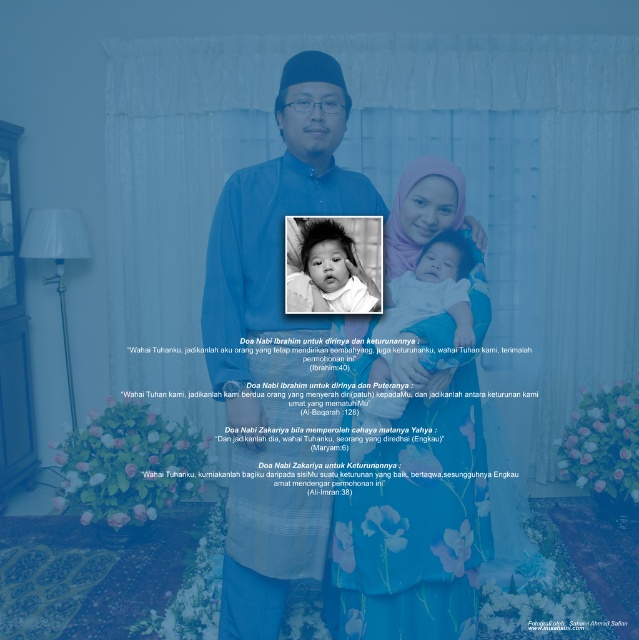
Measure the distance between point (450, 289) and camera.

The distance of point (450, 289) from camera is 2.27 meters.

Can you confirm if black and white baby at center is positioned above smooth white baby at center?

Incorrect, black and white baby at center is not positioned above smooth white baby at center.

At what (x,y) coordinates should I click in order to perform the action: click on black and white baby at center. Please return your answer as a coordinate pair (x, y). Image resolution: width=639 pixels, height=640 pixels. Looking at the image, I should click on (413, 323).

Is matte purple hijab at center wider than black and white baby at center?

Correct, the width of matte purple hijab at center exceeds that of black and white baby at center.

Does matte purple hijab at center have a larger size compared to black and white baby at center?

Indeed, matte purple hijab at center has a larger size compared to black and white baby at center.

Between point (387, 408) and point (374, 420), which one is positioned in front?

Point (387, 408) is in front.

At what (x,y) coordinates should I click in order to perform the action: click on matte purple hijab at center. Please return your answer as a coordinate pair (x, y). This screenshot has width=639, height=640. Looking at the image, I should click on (417, 440).

Based on the photo, between matte blue shirt at center and smooth white baby at center, which one has less height?

smooth white baby at center is shorter.

Is matte blue shirt at center shorter than smooth white baby at center?

No, matte blue shirt at center is not shorter than smooth white baby at center.

Does point (249, 381) come farther from viewer compared to point (374, 232)?

Yes, point (249, 381) is behind point (374, 232).

Image resolution: width=639 pixels, height=640 pixels. I want to click on matte blue shirt at center, so (x=277, y=355).